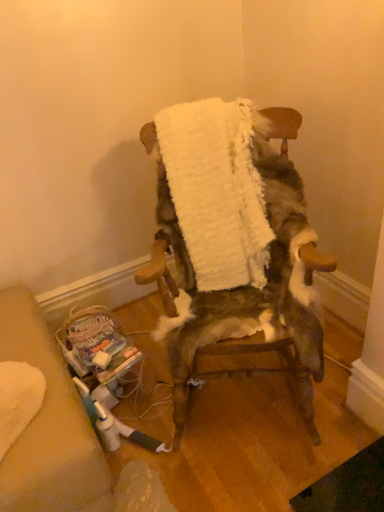
Question: From a real-world perspective, is white fluffy blanket at center on wooden rocking chair at center?

Choices:
 (A) no
 (B) yes

Answer: (B)

Question: From a real-world perspective, is white fluffy blanket at center located beneath wooden rocking chair at center?

Choices:
 (A) no
 (B) yes

Answer: (A)

Question: Can you confirm if white fluffy blanket at center is thinner than wooden rocking chair at center?

Choices:
 (A) yes
 (B) no

Answer: (A)

Question: Is white fluffy blanket at center not close to wooden rocking chair at center?

Choices:
 (A) no
 (B) yes

Answer: (A)

Question: Is white fluffy blanket at center wider than wooden rocking chair at center?

Choices:
 (A) no
 (B) yes

Answer: (A)

Question: Is wooden rocking chair at center inside white fluffy blanket at center?

Choices:
 (A) no
 (B) yes

Answer: (A)

Question: Does wooden rocking chair at center have a smaller size compared to white fluffy blanket at center?

Choices:
 (A) no
 (B) yes

Answer: (A)

Question: Is wooden rocking chair at center to the right of white fluffy blanket at center from the viewer's perspective?

Choices:
 (A) no
 (B) yes

Answer: (B)

Question: Is white fluffy blanket at center a part of wooden rocking chair at center?

Choices:
 (A) no
 (B) yes

Answer: (B)

Question: Is wooden rocking chair at center not close to white fluffy blanket at center?

Choices:
 (A) no
 (B) yes

Answer: (A)

Question: Considering the relative sizes of wooden rocking chair at center and white fluffy blanket at center in the image provided, is wooden rocking chair at center taller than white fluffy blanket at center?

Choices:
 (A) no
 (B) yes

Answer: (B)

Question: Does wooden rocking chair at center have a lesser width compared to white fluffy blanket at center?

Choices:
 (A) no
 (B) yes

Answer: (A)

Question: Is point [183, 195] closer or farther from the camera than point [292, 256]?

Choices:
 (A) closer
 (B) farther

Answer: (B)